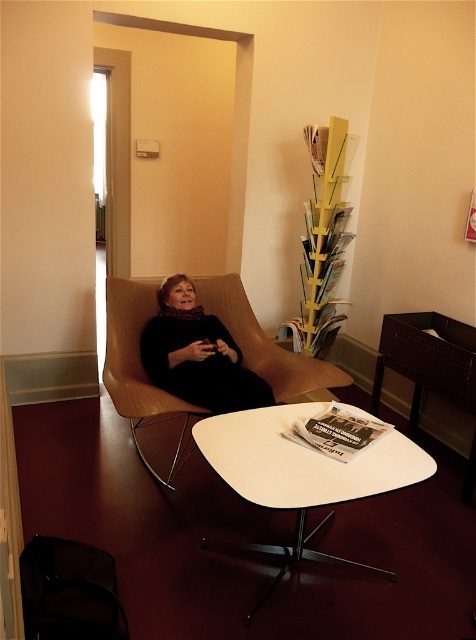
You are a cleaning robot with a width of 24 inches. You are positioned near the white glossy table at center and need to move to the wooden chair at center. Can you navigate the space between them without hitting either object?

The distance between the white glossy table at center and the wooden chair at center is 26.20 inches. Since your width is 24 inches, you can safely navigate the space between them as the distance is greater than your width.

You are a person who wants to sit down at the white glossy table at center. There is a wooden chair at center available. Can you comfortably sit at the table using the chair?

The white glossy table at center is not as tall as wooden chair at center, meaning the chair is taller than the table. This mismatch in height might make sitting comfortably difficult as the chair could be too high for the table.

Based on the photo, A small dog is sitting on the black soft fabric woman at center. The dog wants to jump onto the white coffee table with black metal base at lower left. Can the dog reach the table from its current position?

The distance between the black soft fabric woman at center and the white coffee table with black metal base at lower left is 8.07 feet. Since the dog is on the woman, it would need to jump 8.07 feet to reach the table, which is likely too far for a small dog. Therefore, the dog cannot reach the table from its current position.